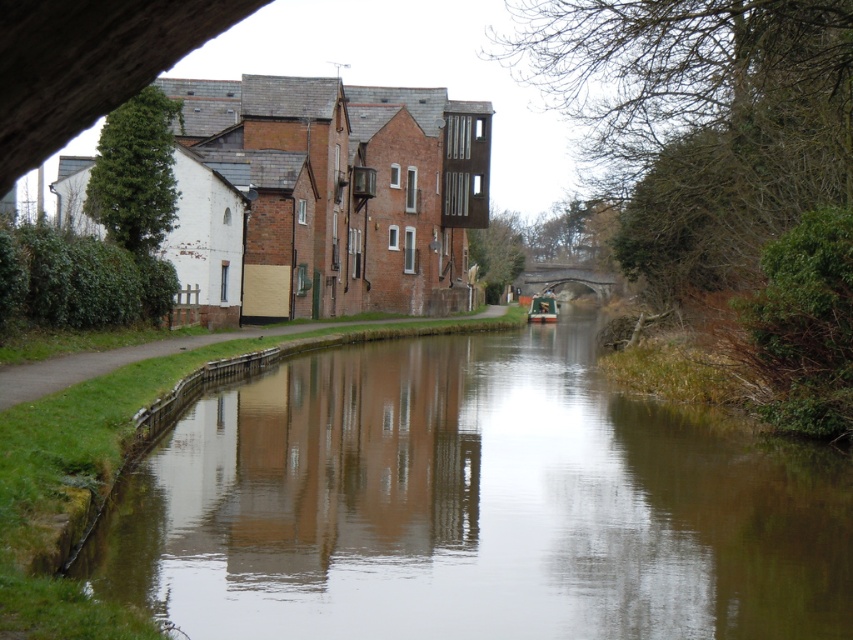
Question: Which point appears farthest from the camera in this image?

Choices:
 (A) (529, 317)
 (B) (583, 365)
 (C) (590, 269)

Answer: (C)

Question: Which point is closer to the camera?

Choices:
 (A) [527, 269]
 (B) [370, 452]
 (C) [532, 310]

Answer: (B)

Question: Which object appears farthest from the camera in this image?

Choices:
 (A) stone arch bridge at center
 (B) green matte boat at center
 (C) smooth brown water at center

Answer: (A)

Question: Is smooth brown water at center to the right of stone arch bridge at center from the viewer's perspective?

Choices:
 (A) no
 (B) yes

Answer: (A)

Question: Is stone arch bridge at center closer to camera compared to green matte boat at center?

Choices:
 (A) yes
 (B) no

Answer: (B)

Question: Can you confirm if smooth brown water at center is smaller than stone arch bridge at center?

Choices:
 (A) yes
 (B) no

Answer: (A)